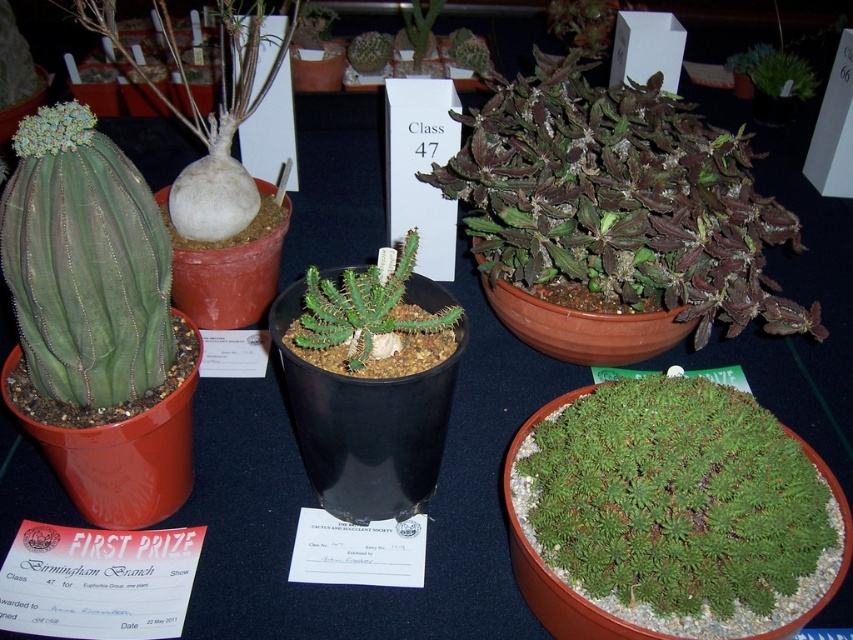
Question: Is green matte cactus at left thinner than matte green succulent at center?

Choices:
 (A) no
 (B) yes

Answer: (A)

Question: Can you confirm if green fuzzy mat at center is positioned to the right of matte green succulent at center?

Choices:
 (A) no
 (B) yes

Answer: (B)

Question: Which of the following is the farthest from the observer?

Choices:
 (A) (399, 332)
 (B) (503, 192)
 (C) (738, 493)

Answer: (B)

Question: Is the position of dark green succulent at center less distant than that of green spiky cactus at center?

Choices:
 (A) no
 (B) yes

Answer: (A)

Question: Which point is closer to the camera?

Choices:
 (A) matte green succulent at center
 (B) green spiky cactus at center
 (C) green fuzzy plant at upper right
 (D) dark green succulent at center

Answer: (B)

Question: Which point is closer to the camera?

Choices:
 (A) green spiky cactus at center
 (B) green matte cactus at left

Answer: (B)